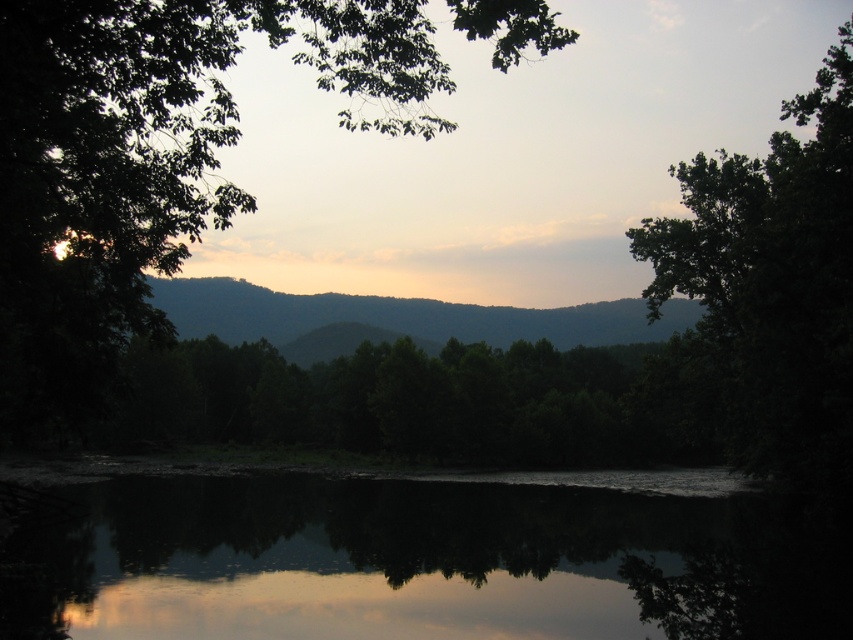
Measure the distance between point (759,228) and camera.

Point (759,228) is 124.32 feet away from camera.

Can you confirm if green leafy tree at upper right is positioned below green matte mountain at center?

Incorrect, green leafy tree at upper right is not positioned below green matte mountain at center.

Locate an element on the screen. This screenshot has height=640, width=853. green leafy tree at upper right is located at coordinates (770, 285).

The width and height of the screenshot is (853, 640). Find the location of `green leafy tree at upper right`. green leafy tree at upper right is located at coordinates (770, 285).

Can you confirm if green leafy tree at center is wider than green matte mountain at center?

In fact, green leafy tree at center might be narrower than green matte mountain at center.

Which is in front, point (126, 44) or point (578, 323)?

Positioned in front is point (126, 44).

Where is `green leafy tree at center`? The width and height of the screenshot is (853, 640). green leafy tree at center is located at coordinates (148, 161).

Is point (405, 570) behind point (819, 428)?

No, (405, 570) is in front of (819, 428).

Is reflective dark water at center in front of green leafy tree at upper right?

Yes.

Is point (252, 580) less distant than point (831, 275)?

Yes, point (252, 580) is in front of point (831, 275).

Find the location of a particular element. This screenshot has width=853, height=640. reflective dark water at center is located at coordinates (418, 557).